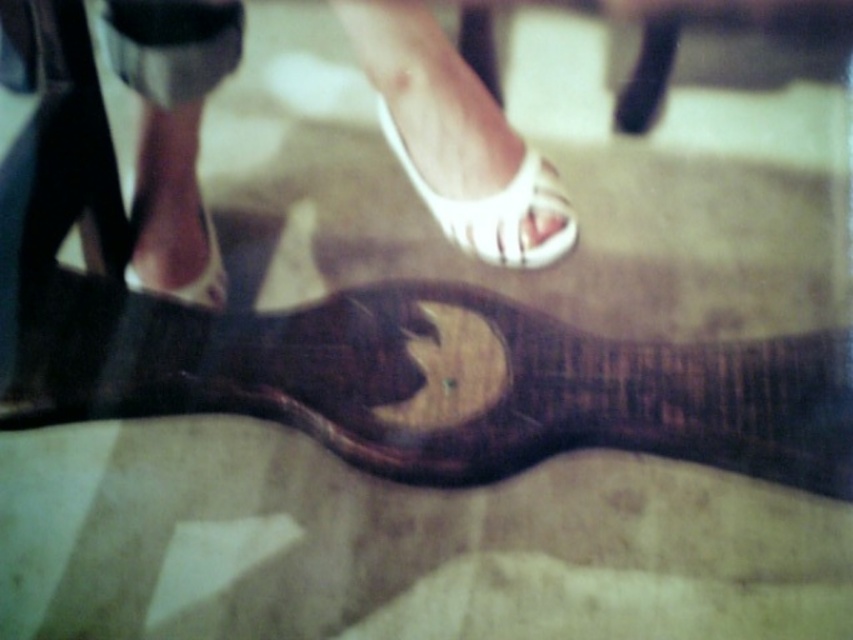
What do you see at coordinates (457, 140) in the screenshot? I see `white leather sandals at upper center` at bounding box center [457, 140].

Between point (410, 141) and point (201, 301), which one is positioned behind?

The point (201, 301) is behind.

You are a GUI agent. You are given a task and a screenshot of the screen. Output one action in this format:
    pyautogui.click(x=<x>, y=<y>)
    Task: Click on the white leather sandals at upper center
    The height and width of the screenshot is (640, 853).
    Given the screenshot: What is the action you would take?
    pyautogui.click(x=457, y=140)

Is point (529, 266) less distant than point (207, 289)?

Yes, it is in front of point (207, 289).

Is white matte sandal at center below matte black high-heeled shoe at left?

Incorrect, white matte sandal at center is not positioned below matte black high-heeled shoe at left.

The height and width of the screenshot is (640, 853). I want to click on white matte sandal at center, so click(494, 209).

Find the location of a particular element. white matte sandal at center is located at coordinates (494, 209).

Can you confirm if wooden acoustic guitar at center is shorter than white matte sandal at center?

Correct, wooden acoustic guitar at center is not as tall as white matte sandal at center.

Does wooden acoustic guitar at center appear on the left side of white matte sandal at center?

In fact, wooden acoustic guitar at center is to the right of white matte sandal at center.

Who is more forward, (x=474, y=356) or (x=389, y=147)?

Point (x=474, y=356) is in front.

Locate an element on the screen. wooden acoustic guitar at center is located at coordinates point(439,381).